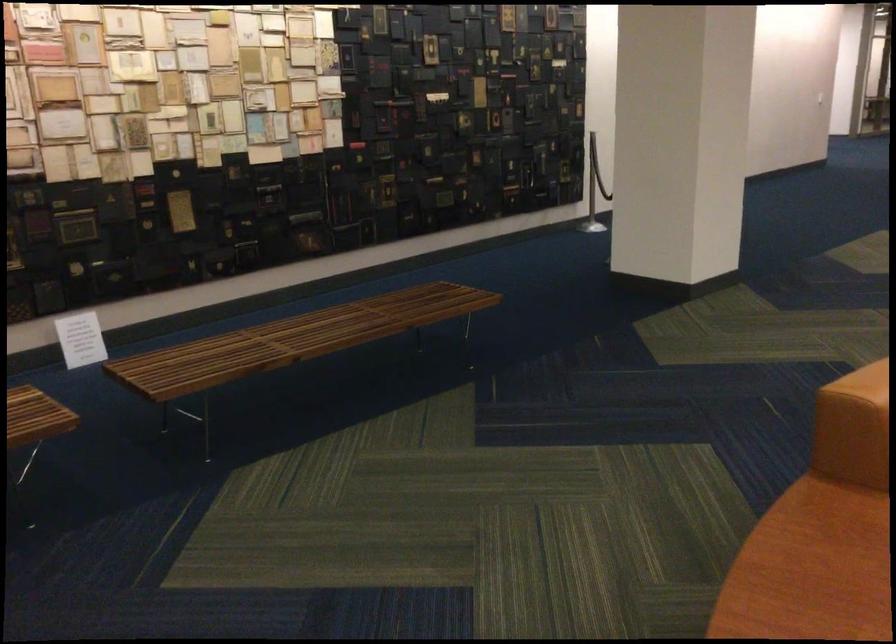
At what (x,y) coordinates should I click in order to perform the action: click on chair sitting surface. Please return your answer as a coordinate pair (x, y). Looking at the image, I should click on (x=808, y=570).